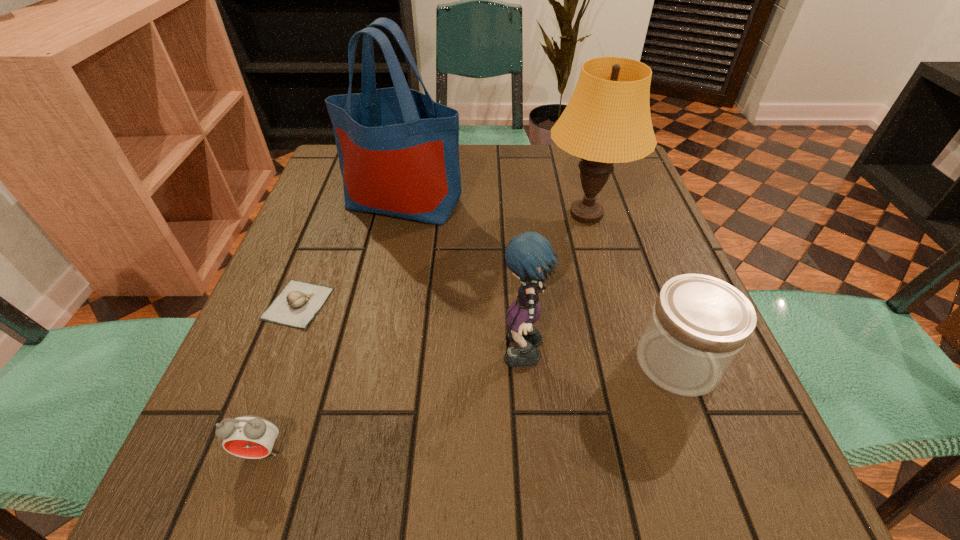
You are a GUI agent. You are given a task and a screenshot of the screen. Output one action in this format:
    pyautogui.click(x=<x>, y=<y>)
    Task: Click on the free space between the handbag and the alarm clock
    
    Given the screenshot: What is the action you would take?
    pyautogui.click(x=332, y=327)

Locate an element on the screen. unoccupied area between the fourth shortest object and the alarm clock is located at coordinates (393, 404).

This screenshot has height=540, width=960. In order to click on empty space between the jar and the rag doll in this screenshot , I will do `click(601, 359)`.

Where is `free space between the fifth tallest object and the handbag`? This screenshot has height=540, width=960. free space between the fifth tallest object and the handbag is located at coordinates (332, 327).

At what (x,y) coordinates should I click in order to perform the action: click on vacant area that lies between the rag doll and the shortest object. Please return your answer as a coordinate pair (x, y). The image size is (960, 540). Looking at the image, I should click on (411, 330).

Where is `vacant space in between the handbag and the garlic`? The width and height of the screenshot is (960, 540). vacant space in between the handbag and the garlic is located at coordinates (350, 253).

What are the coordinates of `free space between the second shortest object and the fifth shortest object` in the screenshot? It's located at (424, 333).

The height and width of the screenshot is (540, 960). Find the location of `free space between the nearest object and the handbag`. free space between the nearest object and the handbag is located at coordinates (332, 327).

Where is `free space between the fourth tallest object and the lampshade`? The height and width of the screenshot is (540, 960). free space between the fourth tallest object and the lampshade is located at coordinates (632, 288).

Identify which object is located as the fourth nearest to the handbag. Please provide its 2D coordinates. Your answer should be formatted as a tuple, i.e. [(x, y)], where the tuple contains the x and y coordinates of a point satisfying the conditions above.

[(699, 324)]